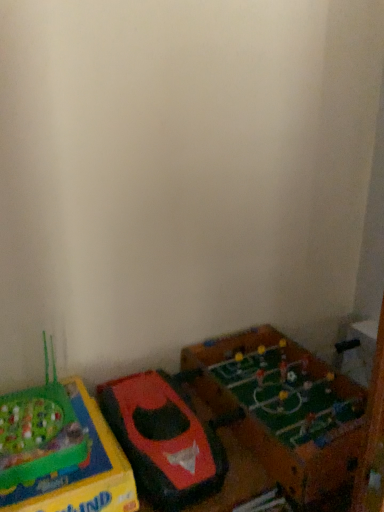
Question: From a real-world perspective, is green matte foosball table at lower right, which is the third toy in left-to-right order, physically located above or below green plastic game at lower left, which appears as the third toy when viewed from the right?

Choices:
 (A) below
 (B) above

Answer: (B)

Question: Looking at the image, does green matte foosball table at lower right, the 1th toy in the right-to-left sequence, seem bigger or smaller compared to green plastic game at lower left, marked as the 1th toy in a left-to-right arrangement?

Choices:
 (A) small
 (B) big

Answer: (B)

Question: Estimate the real-world distances between objects in this image. Which object is farther from the rubberized red toy boat at lower left, placed as the 2th toy when sorted from left to right?

Choices:
 (A) green matte foosball table at lower right, the 1th toy in the right-to-left sequence
 (B) green plastic game at lower left, marked as the 1th toy in a left-to-right arrangement

Answer: (A)

Question: Which object is the farthest from the rubberized red toy boat at lower left, placed as the 2th toy when sorted from left to right?

Choices:
 (A) green plastic game at lower left, which appears as the third toy when viewed from the right
 (B) green matte foosball table at lower right, the 1th toy in the right-to-left sequence

Answer: (B)